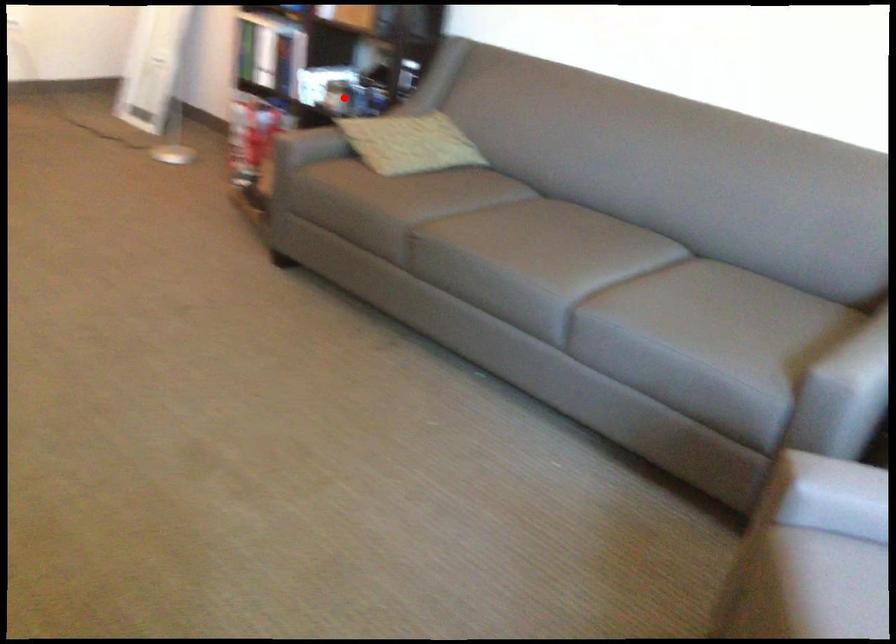
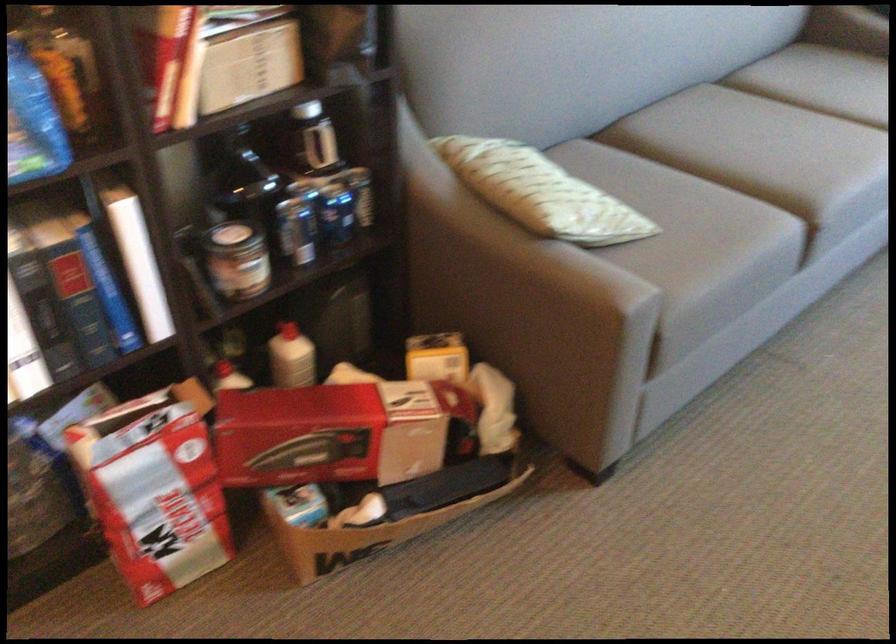
Locate, in the second image, the point that corresponds to the highlighted location in the first image.

(338, 218)